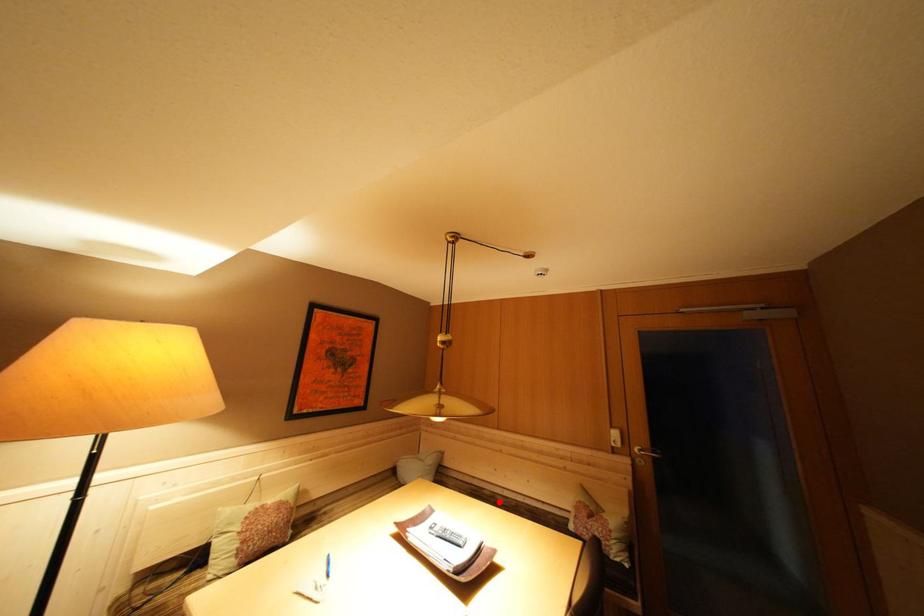
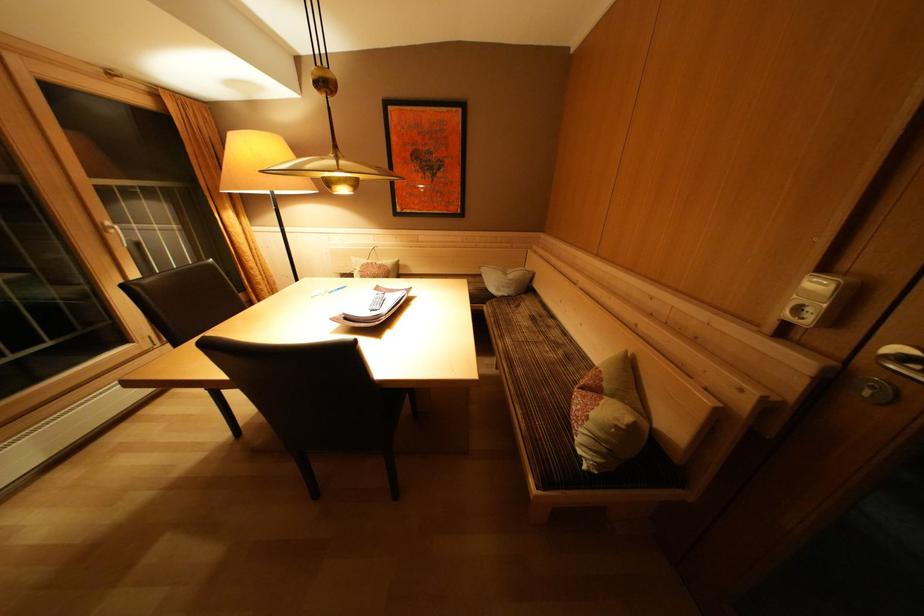
Question: I am providing you with two images of the same scene from different viewpoints. Image1 has a red point marked. In image2, the corresponding 3D location appears at what relative position? Reply with the corresponding letter.

Choices:
 (A) Closer
 (B) Farther

Answer: (A)